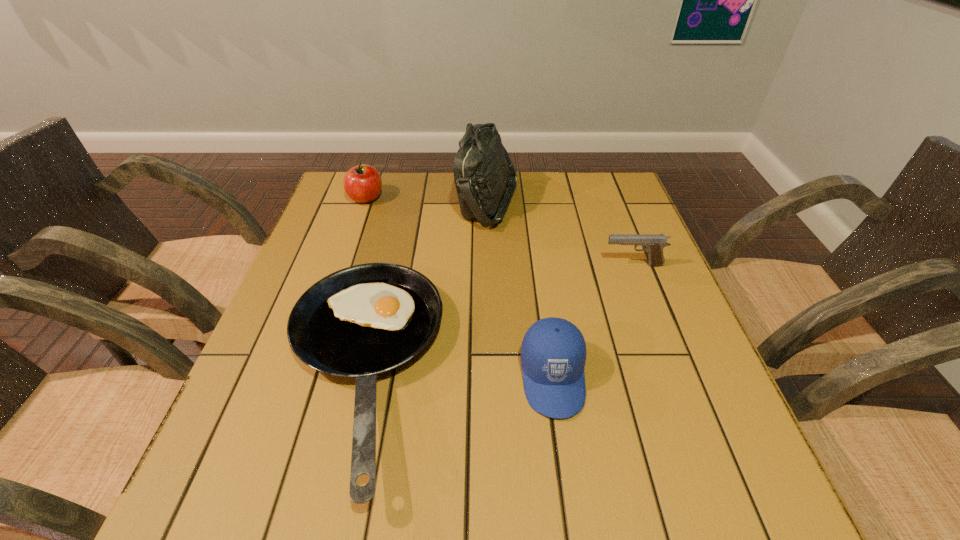
In order to click on free location located 0.080m on the front-facing side of the cap in this screenshot , I will do `click(565, 466)`.

Where is `free space located at the barrel of the pistol`? The width and height of the screenshot is (960, 540). free space located at the barrel of the pistol is located at coordinates (530, 265).

Identify the location of vacant region located 0.210m at the barrel of the pistol. (517, 265).

Where is `vacant area situated 0.400m at the barrel of the pistol`? vacant area situated 0.400m at the barrel of the pistol is located at coordinates (440, 265).

In order to click on free space located on the right of the shortest object in this screenshot , I will do `click(626, 372)`.

Locate an element on the screen. The height and width of the screenshot is (540, 960). shoulder bag present at the far edge is located at coordinates (483, 169).

You are a GUI agent. You are given a task and a screenshot of the screen. Output one action in this format:
    pyautogui.click(x=<x>, y=<y>)
    Task: Click on the apple present at the far edge
    This screenshot has width=960, height=540.
    Given the screenshot: What is the action you would take?
    pyautogui.click(x=362, y=183)

Locate an element on the screen. object positioned at the near edge is located at coordinates (364, 320).

The width and height of the screenshot is (960, 540). I want to click on apple present at the left edge, so pos(362,183).

Identify the location of frying pan located in the left edge section of the desktop. (364, 320).